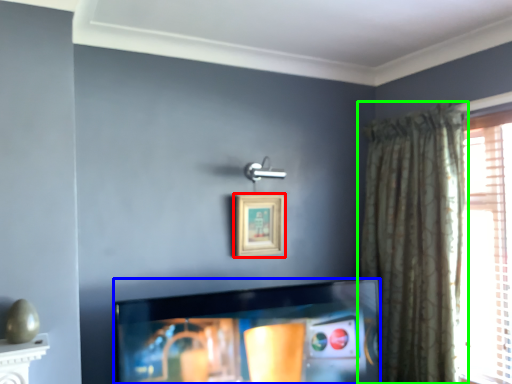
Question: Which object is positioned closest to picture frame (highlighted by a red box)? Select from television (highlighted by a blue box) and curtain (highlighted by a green box).

Choices:
 (A) television
 (B) curtain

Answer: (A)